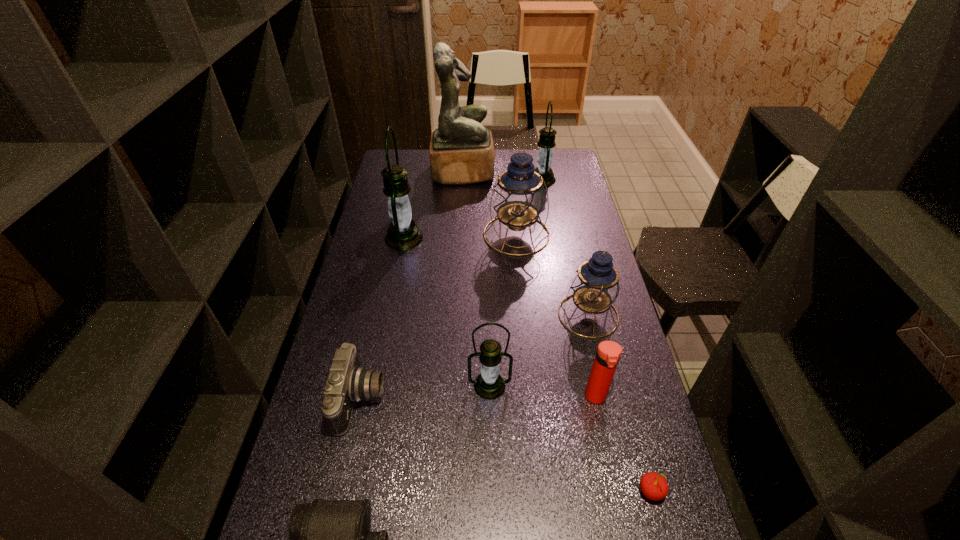
Identify which green lantern is the closest to the second green lantern from right to left. Please provide its 2D coordinates. Your answer should be formatted as a tuple, i.e. [(x, y)], where the tuple contains the x and y coordinates of a point satisfying the conditions above.

[(403, 234)]

Identify the location of vacant space that satisfies the following two spatial constraints: 1. on the side where the second nearest green lantern emits light; 2. on the right side of the fourth shortest object. Image resolution: width=960 pixels, height=540 pixels. (372, 397).

Locate an element on the screen. vacant space that satisfies the following two spatial constraints: 1. on the side where the leftmost green lantern emits light; 2. on the left side of the thermos bottle is located at coordinates (372, 397).

In order to click on vacant area in the image that satisfies the following two spatial constraints: 1. on the front-facing side of the bigger blue lantern; 2. on the side where the second farthest green lantern emits light in this screenshot , I will do `click(516, 238)`.

The width and height of the screenshot is (960, 540). Identify the location of free location that satisfies the following two spatial constraints: 1. on the side where the nearest lantern emits light; 2. on the front-facing side of the black camera. pos(490,399).

Identify the location of free space in the image that satisfies the following two spatial constraints: 1. in a relaxed pose on the tallest object; 2. on the left side of the fourth shortest object. (451, 397).

The image size is (960, 540). Find the location of `free region that satisfies the following two spatial constraints: 1. on the side where the red cherry emits light; 2. on the right side of the farthest green lantern`. free region that satisfies the following two spatial constraints: 1. on the side where the red cherry emits light; 2. on the right side of the farthest green lantern is located at coordinates (602, 491).